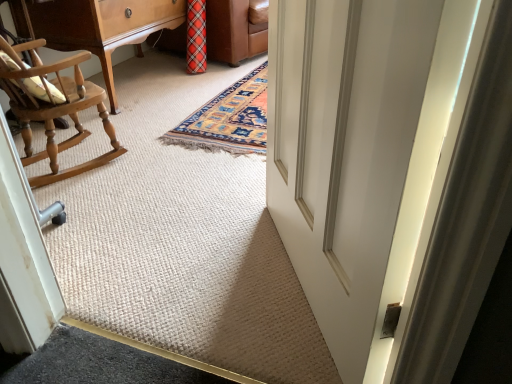
Question: Can you confirm if white smooth door at center is taller than wooden rocking chair at left?

Choices:
 (A) no
 (B) yes

Answer: (B)

Question: Is white smooth door at center placed right next to wooden rocking chair at left?

Choices:
 (A) no
 (B) yes

Answer: (A)

Question: From a real-world perspective, is white smooth door at center on wooden rocking chair at left?

Choices:
 (A) no
 (B) yes

Answer: (B)

Question: Is white smooth door at center looking in the opposite direction of wooden rocking chair at left?

Choices:
 (A) no
 (B) yes

Answer: (A)

Question: Is white smooth door at center aimed at wooden rocking chair at left?

Choices:
 (A) yes
 (B) no

Answer: (B)

Question: Considering the relative positions of white smooth door at center and wooden rocking chair at left in the image provided, is white smooth door at center to the left of wooden rocking chair at left from the viewer's perspective?

Choices:
 (A) yes
 (B) no

Answer: (B)

Question: Does wooden rocking chair at left come in front of white smooth door at center?

Choices:
 (A) no
 (B) yes

Answer: (A)

Question: Is wooden rocking chair at left surrounding white smooth door at center?

Choices:
 (A) no
 (B) yes

Answer: (A)

Question: Does wooden rocking chair at left come behind white smooth door at center?

Choices:
 (A) no
 (B) yes

Answer: (B)

Question: Is wooden rocking chair at left smaller than white smooth door at center?

Choices:
 (A) no
 (B) yes

Answer: (A)

Question: From the image's perspective, would you say wooden rocking chair at left is shown under white smooth door at center?

Choices:
 (A) no
 (B) yes

Answer: (A)

Question: Is wooden rocking chair at left next to white smooth door at center and touching it?

Choices:
 (A) yes
 (B) no

Answer: (B)

Question: From a real-world perspective, is white smooth door at center above or below wooden rocking chair at left?

Choices:
 (A) above
 (B) below

Answer: (A)